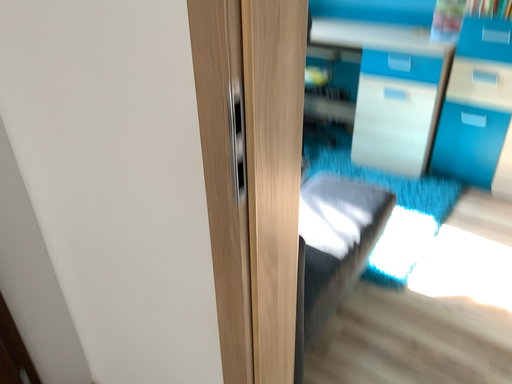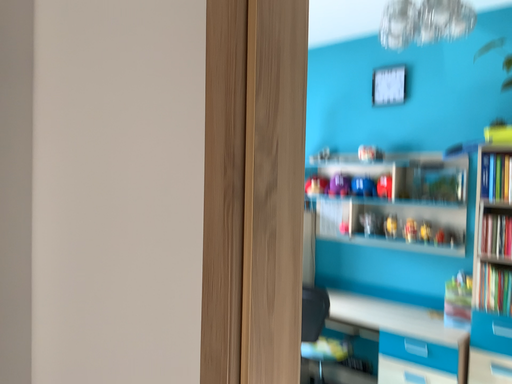
Question: How did the camera likely rotate when shooting the video?

Choices:
 (A) rotated downward
 (B) rotated upward

Answer: (B)